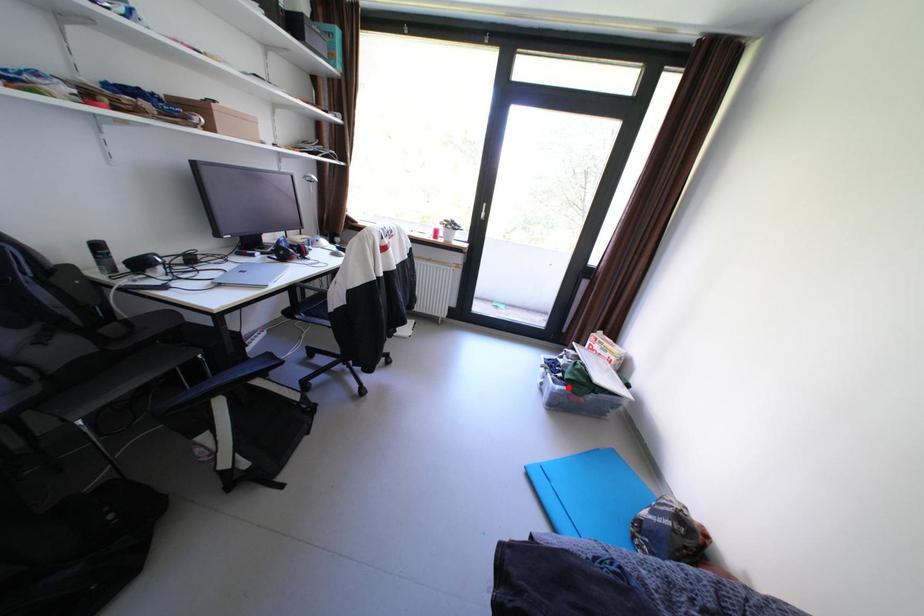
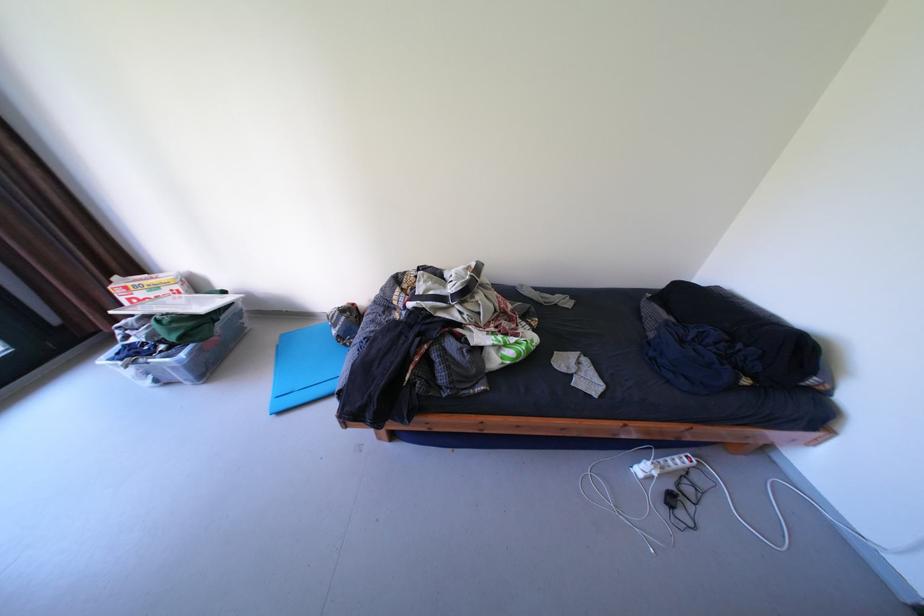
Find the pixel in the second image that matches the highlighted location in the first image.

(193, 355)